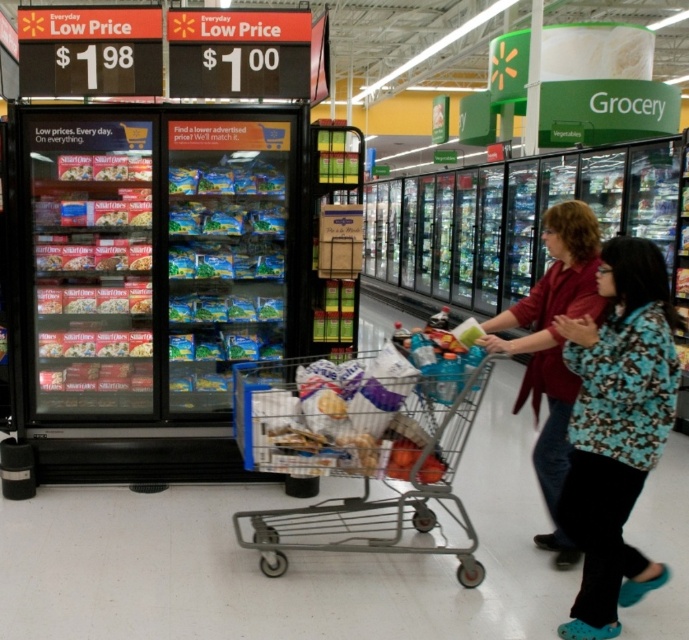
Question: Which object is closer to the camera taking this photo?

Choices:
 (A) floral-patterned shirt at lower right
 (B) metallic silver shopping cart at center

Answer: (A)

Question: Considering the relative positions of metallic silver shopping cart at center and matte red shirt at center in the image provided, where is metallic silver shopping cart at center located with respect to matte red shirt at center?

Choices:
 (A) left
 (B) right

Answer: (A)

Question: Which of these objects is positioned closest to the matte red shirt at center?

Choices:
 (A) metallic silver shopping cart at center
 (B) floral-patterned shirt at lower right

Answer: (B)

Question: Is metallic silver shopping cart at center positioned before floral-patterned shirt at lower right?

Choices:
 (A) yes
 (B) no

Answer: (B)

Question: Does metallic silver shopping cart at center have a larger size compared to matte red shirt at center?

Choices:
 (A) yes
 (B) no

Answer: (A)

Question: Which point appears closest to the camera in this image?

Choices:
 (A) (553, 536)
 (B) (564, 500)
 (C) (446, 417)

Answer: (B)